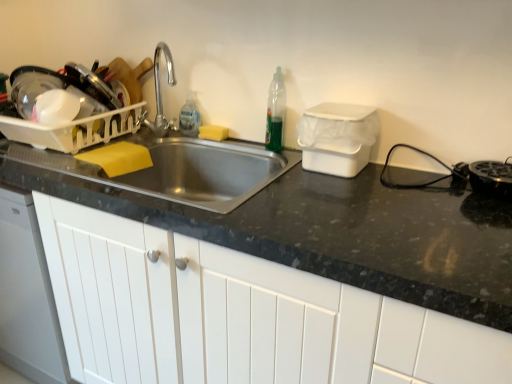
You are a GUI agent. You are given a task and a screenshot of the screen. Output one action in this format:
    pyautogui.click(x=<x>, y=<y>)
    Task: Click on the vacant space that's between green translucent bottle at upper right, the first bottle viewed from the front, and yellow sponge at sink
    This screenshot has height=384, width=512.
    Given the screenshot: What is the action you would take?
    pyautogui.click(x=243, y=142)